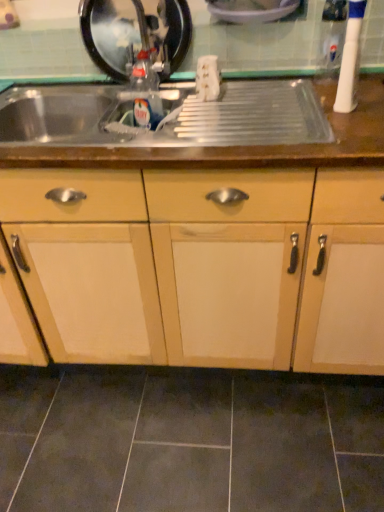
Locate an element on the screen. The image size is (384, 512). vacant area that is in front of white plastic toothbrush at upper right, which is counted as the third appliance, starting from the left is located at coordinates (344, 129).